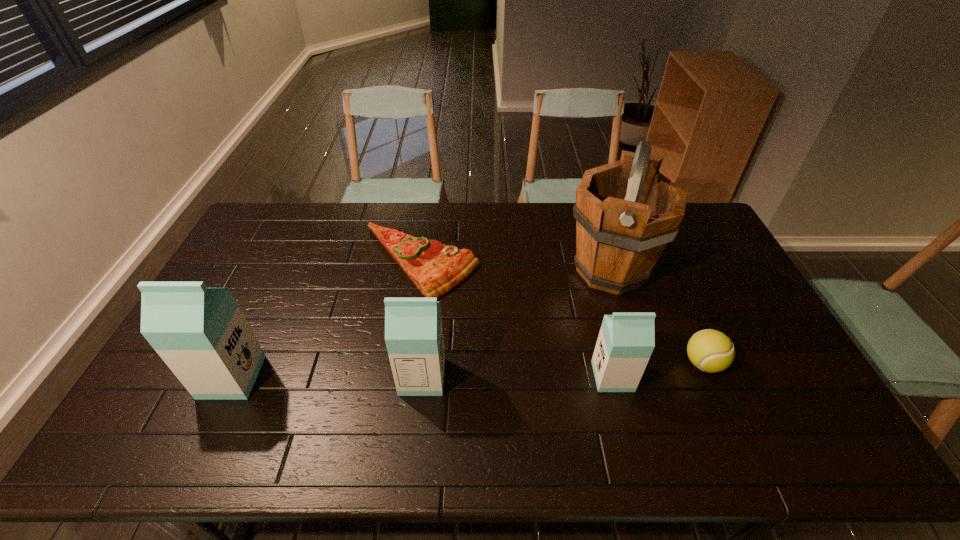
Locate an element on the screen. The image size is (960, 540). vacant place for an extra milk carton on the right is located at coordinates (803, 376).